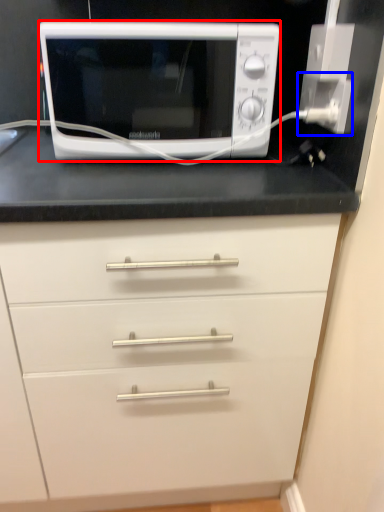
Question: Which object is closer to the camera taking this photo, microwave oven (highlighted by a red box) or electric outlet (highlighted by a blue box)?

Choices:
 (A) microwave oven
 (B) electric outlet

Answer: (A)